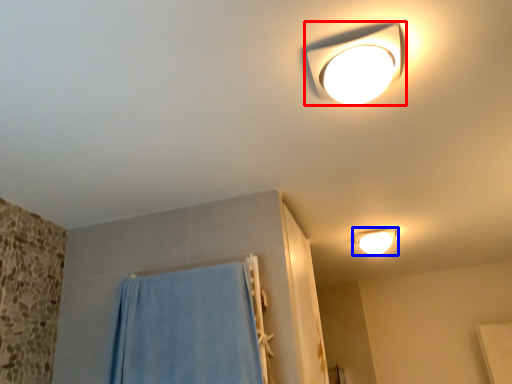
Question: Which point is closer to the camera, lamp (highlighted by a red box) or lamp (highlighted by a blue box)?

Choices:
 (A) lamp
 (B) lamp

Answer: (A)